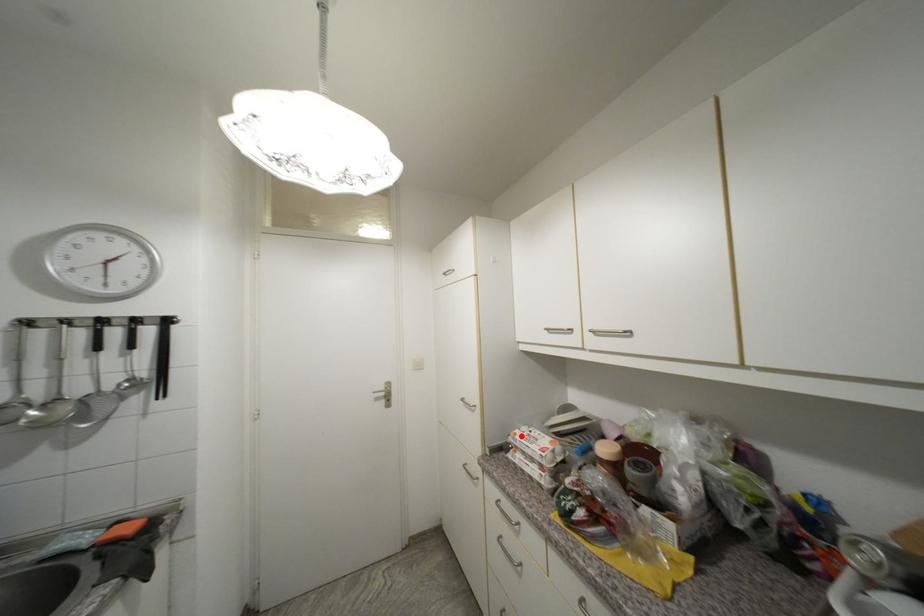
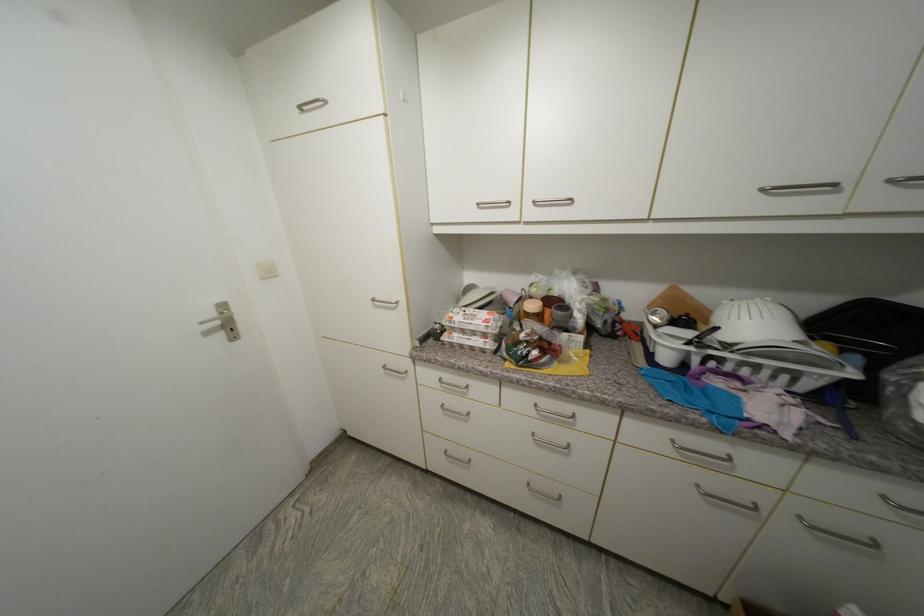
Locate, in the second image, the point that corresponds to the highlighted location in the first image.

(457, 318)